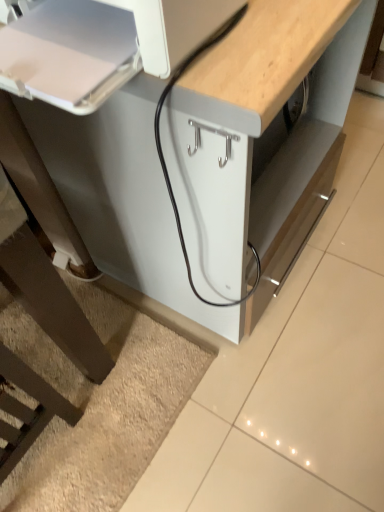
You are a GUI agent. You are given a task and a screenshot of the screen. Output one action in this format:
    pyautogui.click(x=<x>, y=<y>)
    Task: Click on the white glossy cabinet at center
    The height and width of the screenshot is (512, 384).
    Given the screenshot: What is the action you would take?
    pyautogui.click(x=258, y=144)

What do you see at coordinates (258, 144) in the screenshot?
I see `white glossy cabinet at center` at bounding box center [258, 144].

Image resolution: width=384 pixels, height=512 pixels. In order to click on white glossy cabinet at center in this screenshot , I will do `click(258, 144)`.